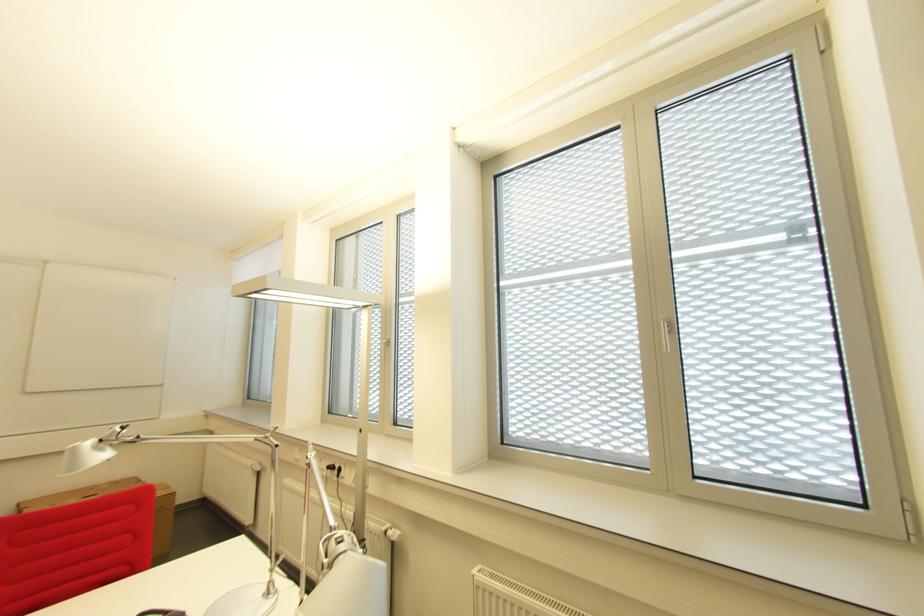
Identify the location of silver desk lamp. The image size is (924, 616). (195, 506).